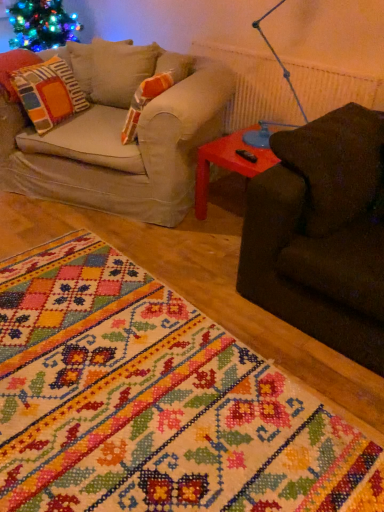
Question: Considering the positions of rubberized plastic side table at right and embroidered fabric rug at lower left in the image, is rubberized plastic side table at right taller or shorter than embroidered fabric rug at lower left?

Choices:
 (A) short
 (B) tall

Answer: (B)

Question: In the image, is rubberized plastic side table at right on the left side or the right side of embroidered fabric rug at lower left?

Choices:
 (A) right
 (B) left

Answer: (A)

Question: Which object is the closest to the embroidered fabric rug at lower left?

Choices:
 (A) rubberized plastic side table at right
 (B) multicolored fabric pillow at left

Answer: (A)

Question: Based on their relative distances, which object is nearer to the rubberized plastic side table at right?

Choices:
 (A) embroidered fabric rug at lower left
 (B) multicolored fabric pillow at left

Answer: (B)